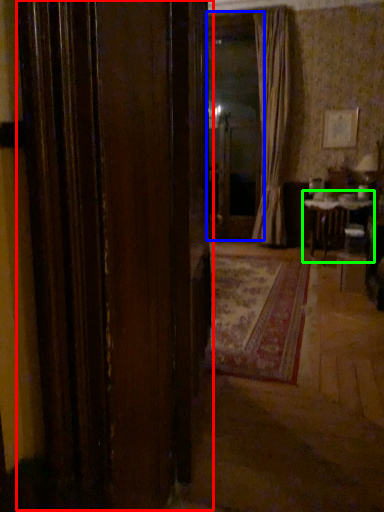
Question: Considering the real-world distances, which object is farthest from door (highlighted by a red box)? window screen (highlighted by a blue box) or table (highlighted by a green box)?

Choices:
 (A) window screen
 (B) table

Answer: (A)